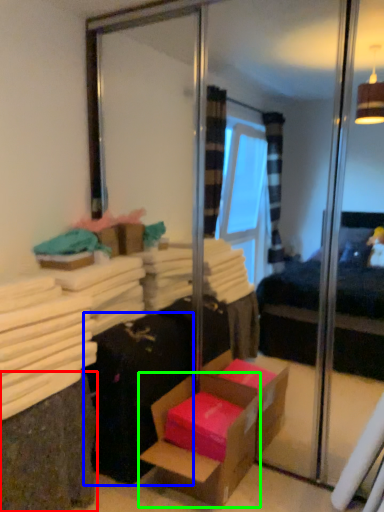
Question: Estimate the real-world distances between objects in this image. Which object is closer to shelf (highlighted by a red box), luggage (highlighted by a blue box) or box (highlighted by a green box)?

Choices:
 (A) luggage
 (B) box

Answer: (A)